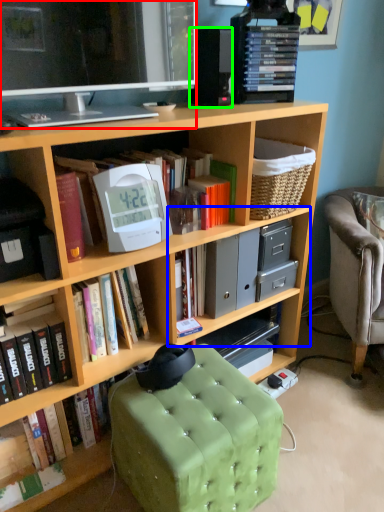
Question: Estimate the real-world distances between objects in this image. Which object is closer to television (highlighted by a red box), cabinet (highlighted by a blue box) or speaker (highlighted by a green box)?

Choices:
 (A) cabinet
 (B) speaker

Answer: (B)